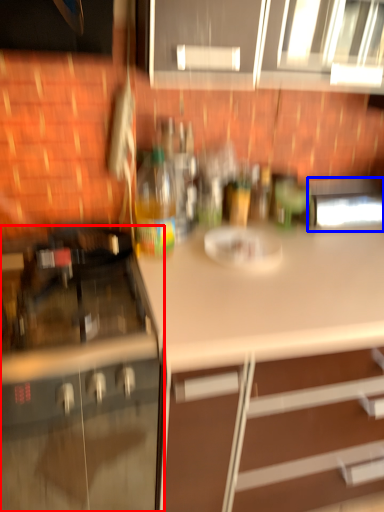
Question: Which object is further to the camera taking this photo, cabinetry (highlighted by a red box) or appliance (highlighted by a blue box)?

Choices:
 (A) cabinetry
 (B) appliance

Answer: (B)